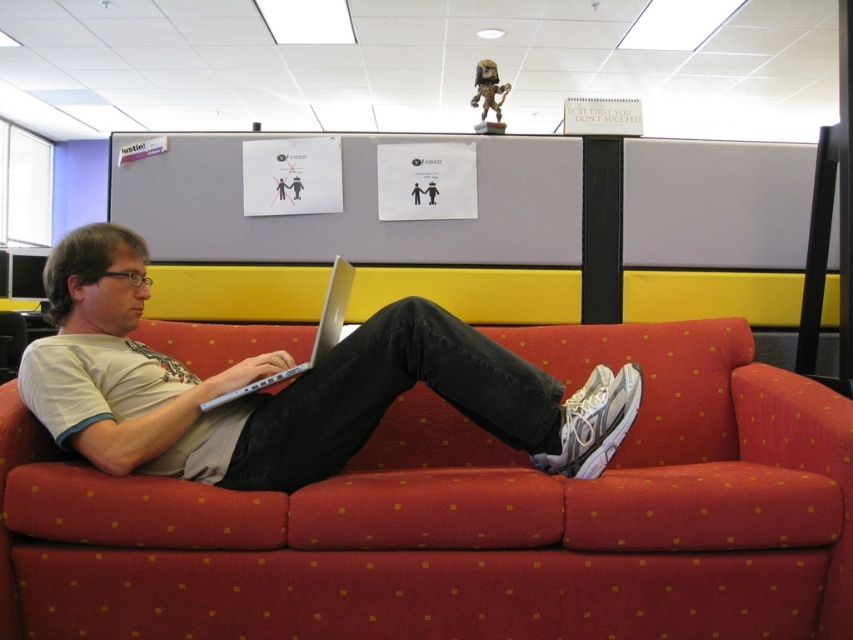
Does white matte shirt at center have a lesser height compared to silver metallic laptop at center?

No, white matte shirt at center is not shorter than silver metallic laptop at center.

Is white matte shirt at center closer to the viewer compared to silver metallic laptop at center?

Yes, white matte shirt at center is in front of silver metallic laptop at center.

Is point (170, 390) less distant than point (341, 294)?

That is True.

This screenshot has height=640, width=853. Find the location of `white matte shirt at center`. white matte shirt at center is located at coordinates (285, 387).

Which is more to the left, red fabric couch at center or white matte shirt at center?

white matte shirt at center is more to the left.

Who is more forward, (x=592, y=564) or (x=372, y=333)?

Point (x=592, y=564) is in front.

Is point (766, 454) farther from viewer compared to point (306, 417)?

Yes, point (766, 454) is behind point (306, 417).

In order to click on red fabric couch at center in this screenshot , I will do `click(469, 520)`.

Between point (630, 449) and point (347, 284), which one is positioned in front?

Point (347, 284)

Does red fabric couch at center have a greater height compared to silver metallic laptop at center?

Yes.

Is point (30, 497) farther from camera compared to point (247, 385)?

No, (30, 497) is closer to viewer.

Where is `red fabric couch at center`? The height and width of the screenshot is (640, 853). red fabric couch at center is located at coordinates (469, 520).